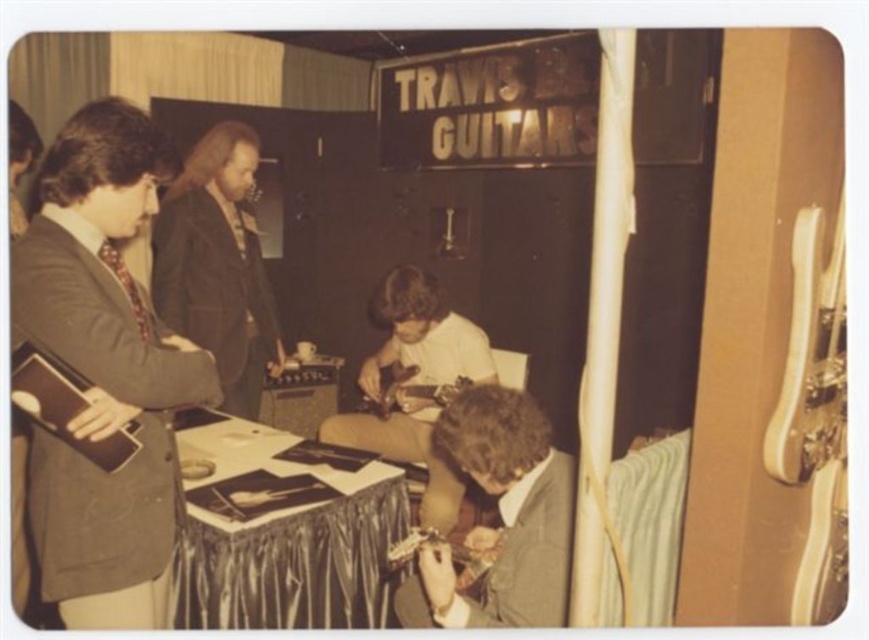
Which is in front, point (326, 534) or point (439, 356)?

Point (326, 534)

Does metallic silver table at center appear on the left side of matte brown guitar at center?

Yes, metallic silver table at center is to the left of matte brown guitar at center.

Find the location of a particular element. The height and width of the screenshot is (640, 869). metallic silver table at center is located at coordinates (284, 538).

In order to click on metallic silver table at center in this screenshot , I will do `click(284, 538)`.

Is matte black guitar at left wider than matte brown guitar at center?

In fact, matte black guitar at left might be narrower than matte brown guitar at center.

Is point (117, 294) behind point (388, 429)?

No, it is not.

You are a GUI agent. You are given a task and a screenshot of the screen. Output one action in this format:
    pyautogui.click(x=<x>, y=<y>)
    Task: Click on the matte black guitar at left
    
    Given the screenshot: What is the action you would take?
    coord(103,372)

Measure the distance between dark brown leather jacket at lower center and matte brown guitar at center.

dark brown leather jacket at lower center and matte brown guitar at center are 36.63 inches apart from each other.

Is dark brown leather jacket at lower center taller than matte brown guitar at center?

No, dark brown leather jacket at lower center is not taller than matte brown guitar at center.

What do you see at coordinates (501, 518) in the screenshot? The width and height of the screenshot is (869, 640). I see `dark brown leather jacket at lower center` at bounding box center [501, 518].

This screenshot has width=869, height=640. Identify the location of dark brown leather jacket at lower center. (501, 518).